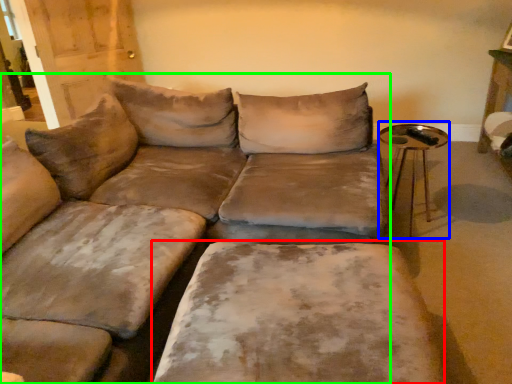
Question: Which is nearer to the wide (highlighted by a red box)? side table (highlighted by a blue box) or studio couch (highlighted by a green box).

Choices:
 (A) side table
 (B) studio couch

Answer: (B)